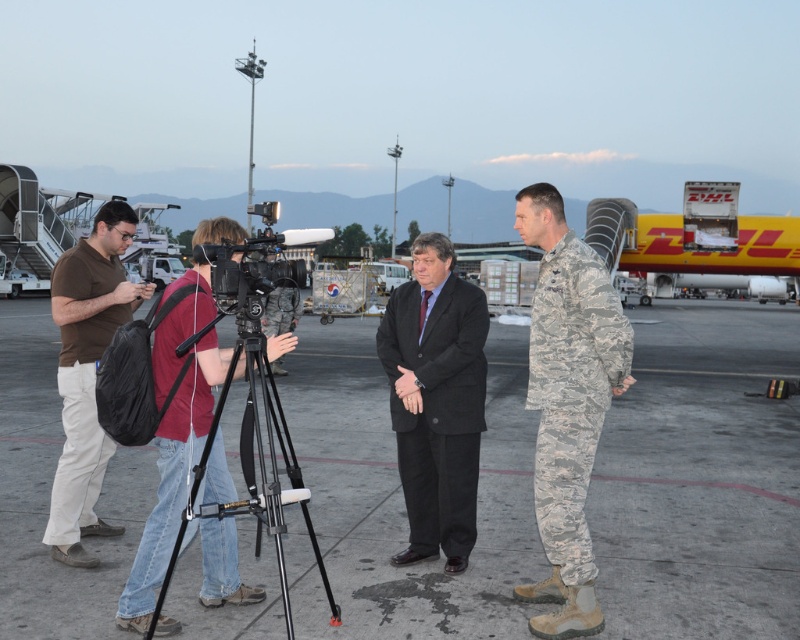
Question: Can you confirm if gray concrete tarmac at center is positioned to the left of dark gray wool suit at center?

Choices:
 (A) no
 (B) yes

Answer: (B)

Question: Does yellow matte cargo container at center have a larger size compared to black metal tripod at center?

Choices:
 (A) no
 (B) yes

Answer: (B)

Question: Is gray concrete tarmac at center above camouflage fabric uniform at center?

Choices:
 (A) no
 (B) yes

Answer: (B)

Question: Among these objects, which one is nearest to the camera?

Choices:
 (A) gray concrete tarmac at center
 (B) camouflage fabric uniform at center
 (C) dark gray wool suit at center
 (D) yellow matte cargo container at center

Answer: (B)

Question: Which object appears closest to the camera in this image?

Choices:
 (A) camouflage fabric uniform at center
 (B) yellow matte cargo container at center

Answer: (A)

Question: Estimate the real-world distances between objects in this image. Which object is closer to the camouflage fabric uniform at right?

Choices:
 (A) dark gray wool suit at center
 (B) black metal tripod at center
 (C) camouflage fabric uniform at center
 (D) yellow matte cargo container at center

Answer: (A)